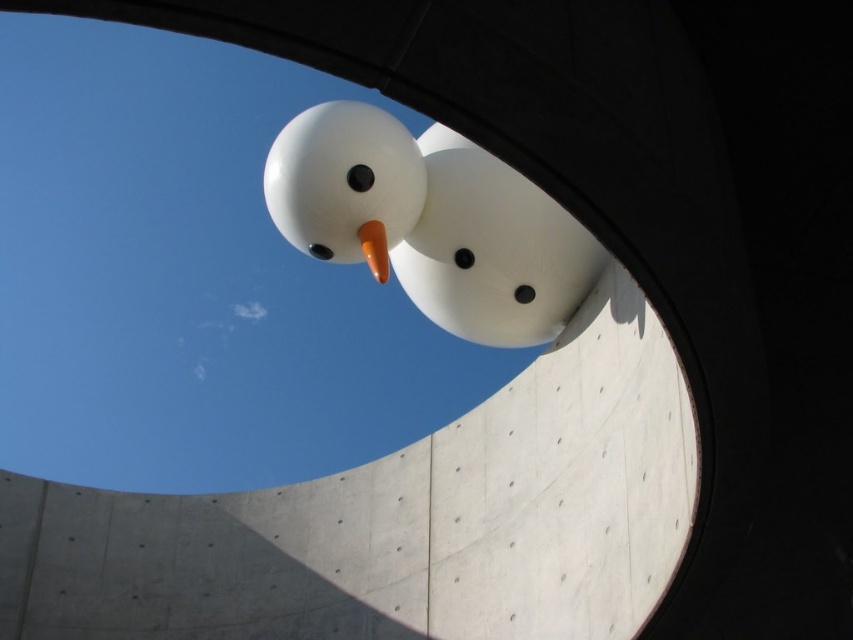
In the scene shown: Is the position of smooth concrete at center less distant than that of white matte snowman at center?

That is True.

Does smooth concrete at center appear on the right side of white matte snowman at center?

No, smooth concrete at center is not to the right of white matte snowman at center.

Is point (619, 470) positioned behind point (572, 298)?

No.

This screenshot has height=640, width=853. Identify the location of smooth concrete at center. (399, 520).